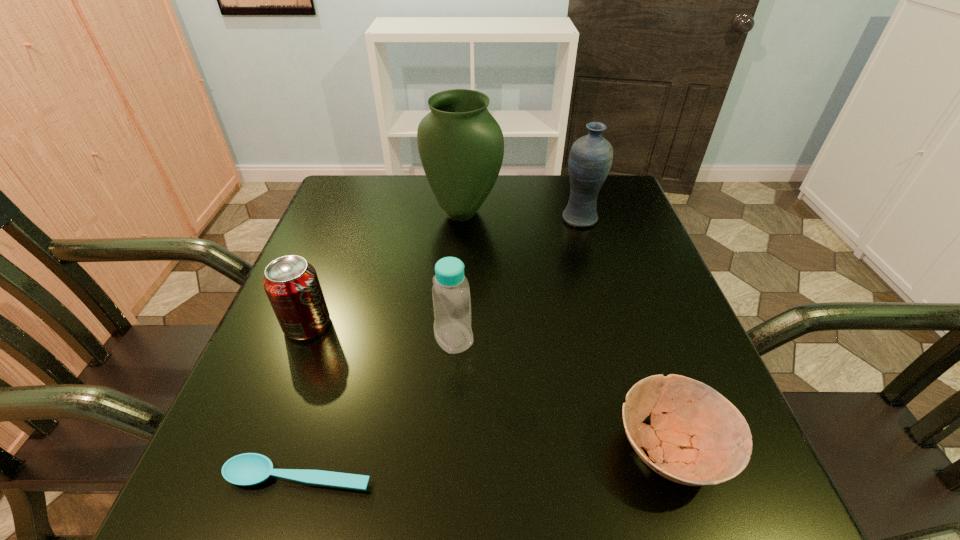
At what (x,y) coordinates should I click in order to perform the action: click on the tallest object. Please return your answer as a coordinate pair (x, y). The image size is (960, 540). Looking at the image, I should click on (461, 146).

You are a GUI agent. You are given a task and a screenshot of the screen. Output one action in this format:
    pyautogui.click(x=<x>, y=<y>)
    Task: Click on the taller vase
    The height and width of the screenshot is (540, 960).
    Given the screenshot: What is the action you would take?
    pyautogui.click(x=461, y=146)

Where is `the right vase`? This screenshot has height=540, width=960. the right vase is located at coordinates (590, 159).

The width and height of the screenshot is (960, 540). I want to click on the fifth shortest object, so click(590, 159).

The height and width of the screenshot is (540, 960). Find the location of `bottle`. bottle is located at coordinates (451, 298).

This screenshot has width=960, height=540. In order to click on the third shortest object in this screenshot , I will do `click(292, 286)`.

The image size is (960, 540). Find the location of `bowl`. bowl is located at coordinates (703, 439).

Where is `spoon`? The height and width of the screenshot is (540, 960). spoon is located at coordinates (247, 469).

Identify the location of blank area located on the front of the left vase. Image resolution: width=960 pixels, height=540 pixels. (457, 313).

Image resolution: width=960 pixels, height=540 pixels. Identify the location of blank area located on the left of the second tallest object. (487, 219).